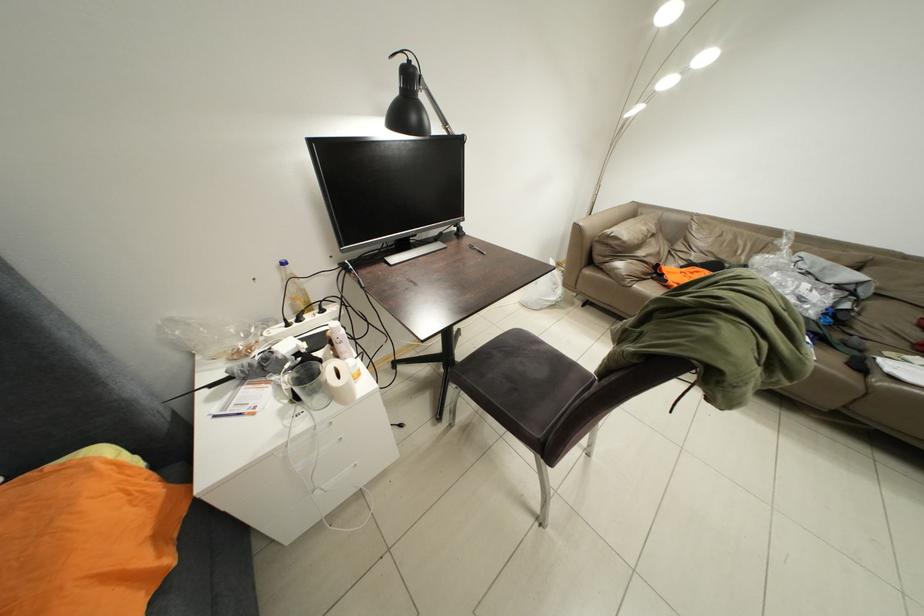
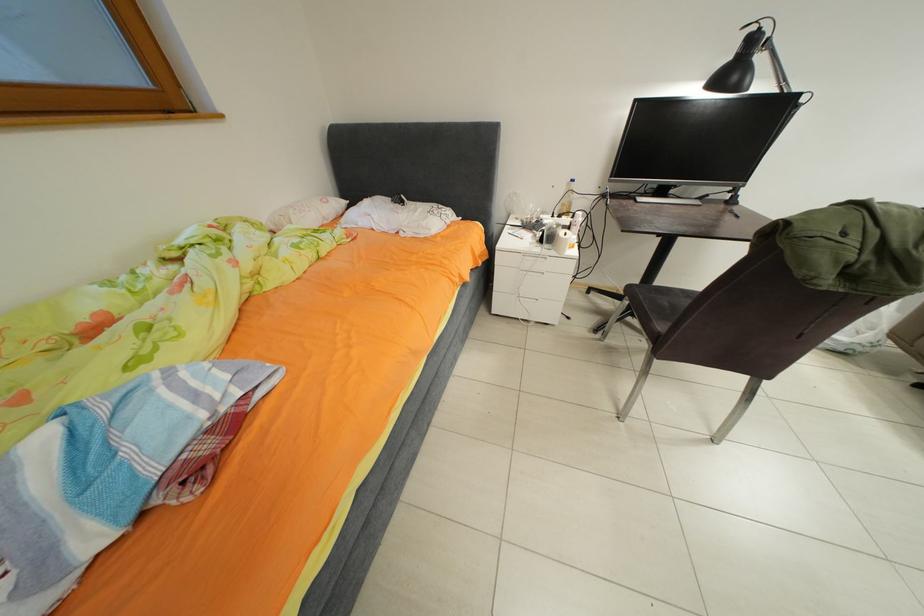
The images are taken continuously from a first-person perspective. In which direction is your viewpoint rotating?

The camera's rotation is toward left-down.